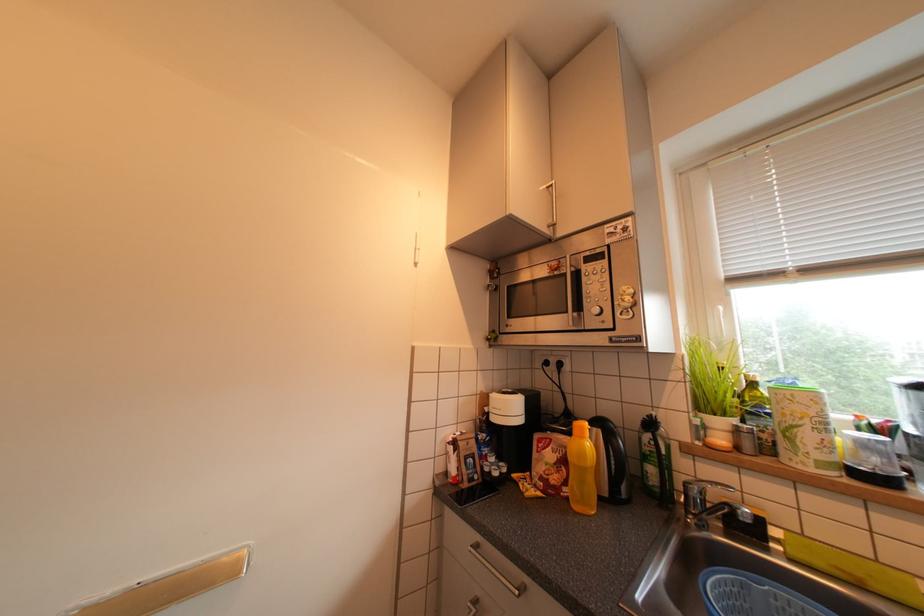
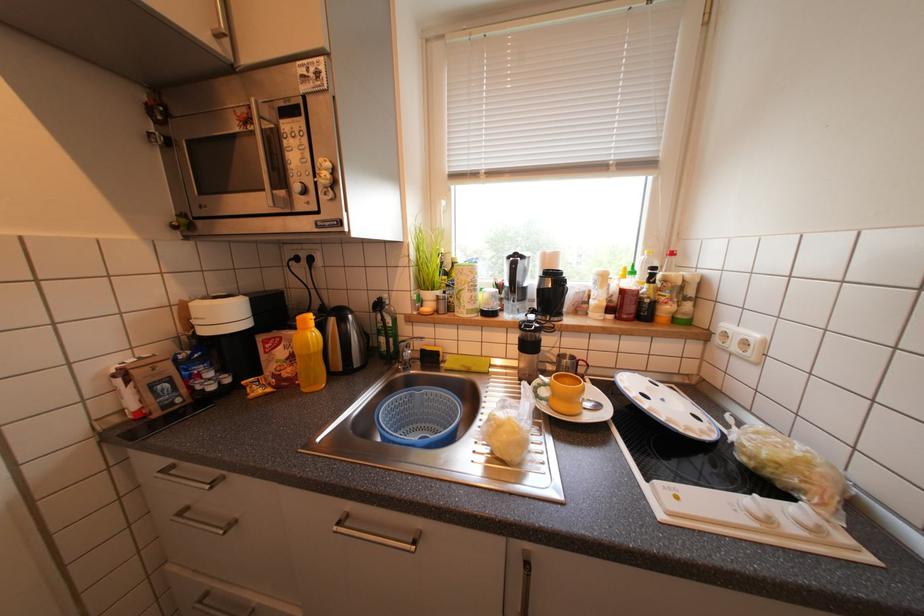
First-person continuous shooting, in which direction is the camera rotating?

The rotation direction of the camera is right-down.